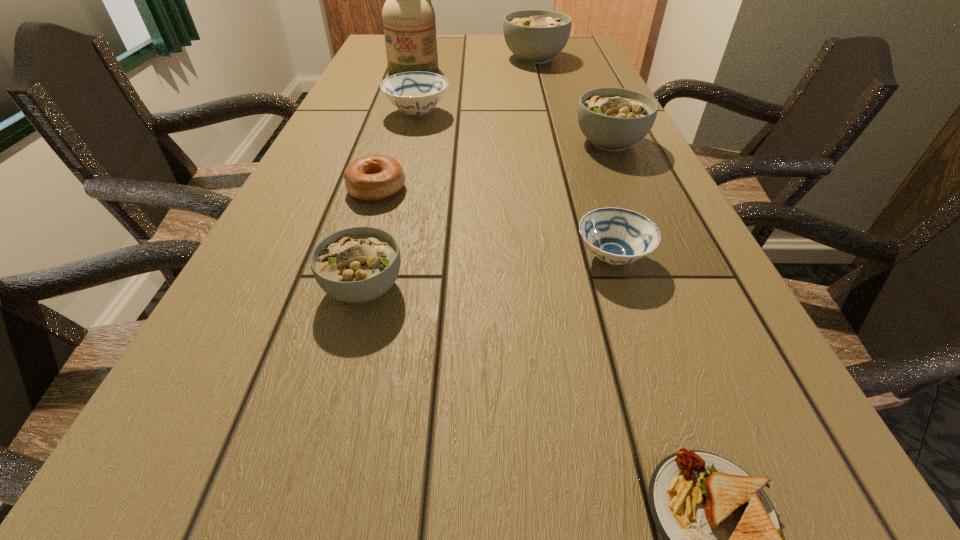
The height and width of the screenshot is (540, 960). Find the location of `vacant space that satisfies the following two spatial constraints: 1. on the front label of the smaller blue soup bowl; 2. on the right side of the tallest object`. vacant space that satisfies the following two spatial constraints: 1. on the front label of the smaller blue soup bowl; 2. on the right side of the tallest object is located at coordinates (357, 258).

The image size is (960, 540). I want to click on vacant space that satisfies the following two spatial constraints: 1. on the front label of the right blue soup bowl; 2. on the left side of the cleansing agent, so click(x=357, y=258).